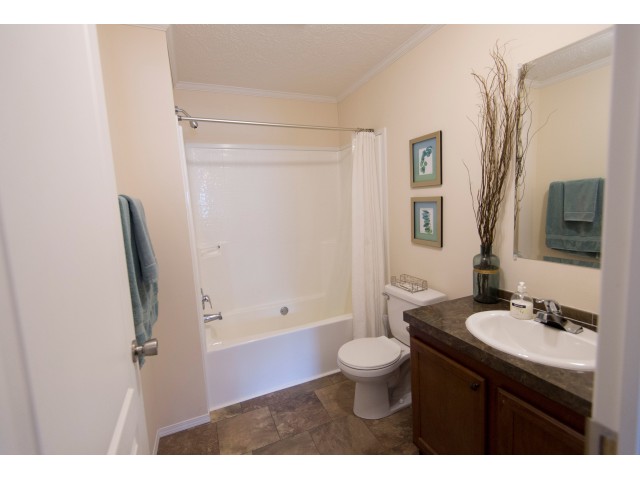
Locate an element on the screen. handles is located at coordinates (547, 316), (139, 352), (216, 313), (208, 300).